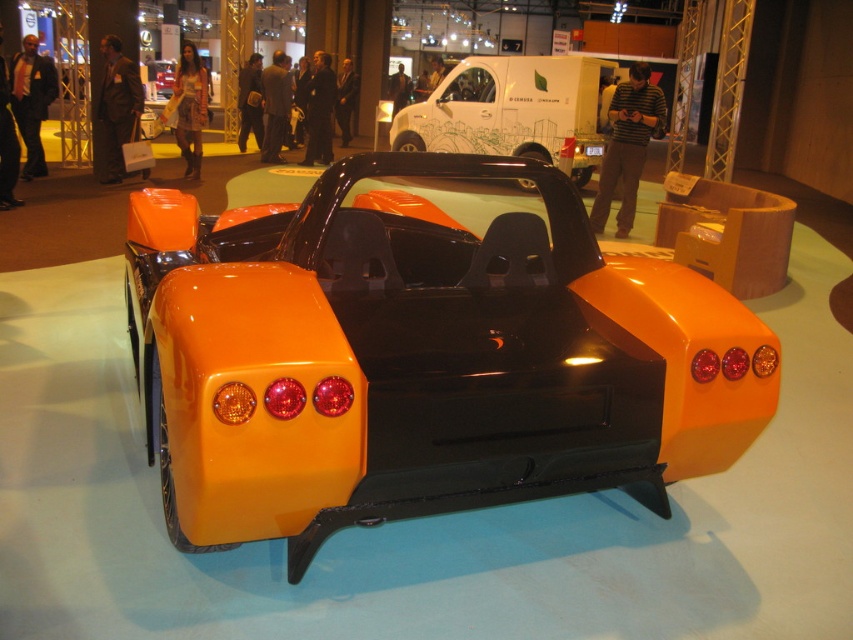
Question: Which point is farther from the camera taking this photo?

Choices:
 (A) pos(515,332)
 (B) pos(596,65)

Answer: (B)

Question: Is glossy orange car at center positioned behind white glossy van at upper center?

Choices:
 (A) no
 (B) yes

Answer: (A)

Question: Is glossy orange car at center positioned before white glossy van at upper center?

Choices:
 (A) no
 (B) yes

Answer: (B)

Question: Which object is closer to the camera taking this photo?

Choices:
 (A) glossy orange car at center
 (B) white glossy van at upper center

Answer: (A)

Question: Is glossy orange car at center below white glossy van at upper center?

Choices:
 (A) yes
 (B) no

Answer: (A)